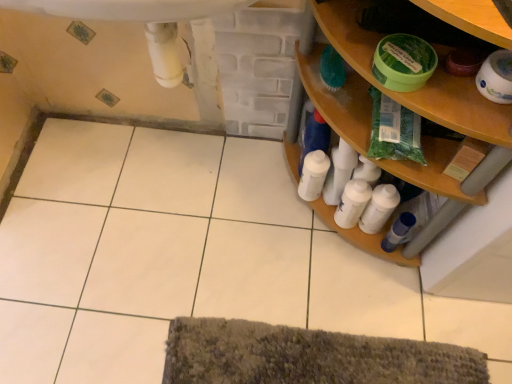
Image resolution: width=512 pixels, height=384 pixels. Describe the element at coordinates (398, 231) in the screenshot. I see `blue glossy bottle at lower right, arranged as the 3th toiletry when viewed from the left` at that location.

The height and width of the screenshot is (384, 512). Describe the element at coordinates (413, 110) in the screenshot. I see `wooden shelf at right` at that location.

In order to face white plastic sink at upper center, should I rotate leftwards or rightwards?

You should rotate left by 15.525 degrees.

The height and width of the screenshot is (384, 512). Identify the location of blue glossy bottle at lower right, which appears as the first toiletry when viewed from the right. (398, 231).

Considering the sizes of objects white glossy bottles at center right, which is the second toiletry in left-to-right order, and blue glossy bottle at lower right, arranged as the 3th toiletry when viewed from the left, in the image provided, who is taller, white glossy bottles at center right, which is the second toiletry in left-to-right order, or blue glossy bottle at lower right, arranged as the 3th toiletry when viewed from the left,?

With more height is white glossy bottles at center right, which is the second toiletry in left-to-right order.

In terms of width, does white glossy bottles at center right, which is the 2th toiletry from right to left, look wider or thinner when compared to blue glossy bottle at lower right, arranged as the 3th toiletry when viewed from the left?

white glossy bottles at center right, which is the 2th toiletry from right to left, is thinner than blue glossy bottle at lower right, arranged as the 3th toiletry when viewed from the left.

Consider the image. Can you confirm if white glossy bottles at center right, which is the second toiletry in left-to-right order, is bigger than blue glossy bottle at lower right, arranged as the 3th toiletry when viewed from the left?

Yes.

From a real-world perspective, which toiletry is the 1st one above the blue glossy bottle at lower right, which appears as the first toiletry when viewed from the right? Please provide its 2D coordinates.

[(379, 208)]

Which is closer, (507,103) or (417,138)?

Positioned in front is point (507,103).

In the scene shown: Considering the relative sizes of white glossy toilet paper at upper right and green plastic bag at upper right in the image provided, is white glossy toilet paper at upper right shorter than green plastic bag at upper right?

Correct, white glossy toilet paper at upper right is not as tall as green plastic bag at upper right.

Is white glossy toilet paper at upper right bigger or smaller than green plastic bag at upper right?

white glossy toilet paper at upper right is smaller than green plastic bag at upper right.

Would you consider white glossy toilet paper at upper right to be distant from green plastic bag at upper right?

That's not correct — white glossy toilet paper at upper right is a little close to green plastic bag at upper right.

From a real-world perspective, is green plastic bag at upper right located beneath wooden shelf at right?

Incorrect, from a real-world perspective, green plastic bag at upper right is higher than wooden shelf at right.

Does green plastic bag at upper right turn towards wooden shelf at right?

Yes, green plastic bag at upper right is facing wooden shelf at right.

Is green plastic bag at upper right beside wooden shelf at right?

green plastic bag at upper right is not next to wooden shelf at right, and they're not touching.

From the image's perspective, is green plastic bag at upper right located beneath wooden shelf at right?

Yes, from the image's perspective, green plastic bag at upper right is below wooden shelf at right.

Is white glossy bottle at lower right, the 3th toiletry viewed from the right, in front of or behind white glossy toilet paper at upper right in the image?

Visually, white glossy bottle at lower right, the 3th toiletry viewed from the right, is located behind white glossy toilet paper at upper right.

How different are the orientations of white glossy bottle at lower right, the first toiletry when ordered from left to right, and white glossy toilet paper at upper right in degrees?

The angle between the facing direction of white glossy bottle at lower right, the first toiletry when ordered from left to right, and the facing direction of white glossy toilet paper at upper right is 29.5 degrees.

Which of these two, white glossy bottle at lower right, the first toiletry when ordered from left to right, or white glossy toilet paper at upper right, is wider?

white glossy toilet paper at upper right.

Considering the sizes of white glossy bottle at lower right, the 3th toiletry viewed from the right, and white glossy toilet paper at upper right in the image, is white glossy bottle at lower right, the 3th toiletry viewed from the right, taller or shorter than white glossy toilet paper at upper right?

Clearly, white glossy bottle at lower right, the 3th toiletry viewed from the right, is taller compared to white glossy toilet paper at upper right.

Considering the sizes of objects white glossy toilet paper at upper right and white glossy bottles at center right, which is the 2th toiletry from right to left, in the image provided, who is thinner, white glossy toilet paper at upper right or white glossy bottles at center right, which is the 2th toiletry from right to left,?

Thinner between the two is white glossy bottles at center right, which is the 2th toiletry from right to left.

Does white glossy toilet paper at upper right contain white glossy bottles at center right, which is the second toiletry in left-to-right order?

No, white glossy toilet paper at upper right does not contain white glossy bottles at center right, which is the second toiletry in left-to-right order.

Which is in front, point (494, 90) or point (378, 202)?

The point (494, 90) is closer.

Is white glossy toilet paper at upper right shorter than white glossy bottles at center right, which is the 2th toiletry from right to left?

Indeed, white glossy toilet paper at upper right has a lesser height compared to white glossy bottles at center right, which is the 2th toiletry from right to left.

From the picture: Is green plastic bag at upper right shorter than white plastic sink at upper center?

Yes.

Is green plastic bag at upper right inside the boundaries of white plastic sink at upper center, or outside?

green plastic bag at upper right exists outside the volume of white plastic sink at upper center.

From the image's perspective, which is below, green plastic bag at upper right or white plastic sink at upper center?

From the image's view, green plastic bag at upper right is below.

Can you confirm if green plastic bag at upper right is thinner than white plastic sink at upper center?

In fact, green plastic bag at upper right might be wider than white plastic sink at upper center.

Considering their positions, is white glossy bottle at lower right, the 3th toiletry viewed from the right, located in front of or behind white glossy bottles at center right, which is the second toiletry in left-to-right order?

white glossy bottle at lower right, the 3th toiletry viewed from the right, is positioned farther from the viewer than white glossy bottles at center right, which is the second toiletry in left-to-right order.

In the scene shown: Is white glossy bottle at lower right, the first toiletry when ordered from left to right, situated inside white glossy bottles at center right, which is the second toiletry in left-to-right order, or outside?

white glossy bottle at lower right, the first toiletry when ordered from left to right, is not inside white glossy bottles at center right, which is the second toiletry in left-to-right order, it's outside.

Is white glossy bottle at lower right, the first toiletry when ordered from left to right, oriented towards white glossy bottles at center right, which is the 2th toiletry from right to left?

No, white glossy bottle at lower right, the first toiletry when ordered from left to right, is not oriented towards white glossy bottles at center right, which is the 2th toiletry from right to left.

I want to click on toiletry that is on the right side of white glossy bottles at center right, which is the second toiletry in left-to-right order, so click(x=398, y=231).

In the image, there is a white glossy toilet paper at upper right. Identify the location of material below it (from the image's perspective). This screenshot has width=512, height=384. (400, 135).

Based on their spatial positions, is blue glossy bottle at lower right, arranged as the 3th toiletry when viewed from the left, or white glossy bottles at center right, which is the second toiletry in left-to-right order, closer to wooden shelf at right?

Based on the image, white glossy bottles at center right, which is the second toiletry in left-to-right order, appears to be nearer to wooden shelf at right.

From the image, which object appears to be farther from green plastic bag at upper right, wooden shelf at right or blue glossy bottle at lower right, which appears as the first toiletry when viewed from the right?

blue glossy bottle at lower right, which appears as the first toiletry when viewed from the right, lies further to green plastic bag at upper right than the other object.

Considering their positions, is white glossy toilet paper at upper right positioned further to white plastic sink at upper center than wooden shelf at right?

white glossy toilet paper at upper right is further to white plastic sink at upper center.

Consider the image. Which object lies nearer to the anchor point white glossy bottle at lower right, the first toiletry when ordered from left to right, white glossy toilet paper at upper right or white glossy bottles at center right, which is the 2th toiletry from right to left?

white glossy bottles at center right, which is the 2th toiletry from right to left, is positioned closer to the anchor white glossy bottle at lower right, the first toiletry when ordered from left to right.

From the image, which object appears to be farther from white glossy bottle at lower right, the first toiletry when ordered from left to right, white glossy bottles at center right, which is the second toiletry in left-to-right order, or wooden shelf at right?

wooden shelf at right is positioned further to the anchor white glossy bottle at lower right, the first toiletry when ordered from left to right.

From the image, which object appears to be nearer to white glossy bottle at lower right, the first toiletry when ordered from left to right, green plastic bag at upper right or white glossy bottles at center right, which is the second toiletry in left-to-right order?

white glossy bottles at center right, which is the second toiletry in left-to-right order, is positioned closer to the anchor white glossy bottle at lower right, the first toiletry when ordered from left to right.

Which object lies nearer to the anchor point white plastic sink at upper center, wooden shelf at right or white glossy bottles at center right, which is the second toiletry in left-to-right order?

wooden shelf at right is positioned closer to the anchor white plastic sink at upper center.

Looking at the image, which one is located further to white plastic sink at upper center, wooden shelf at right or white glossy toilet paper at upper right?

Based on the image, white glossy toilet paper at upper right appears to be further to white plastic sink at upper center.

The height and width of the screenshot is (384, 512). What are the coordinates of `toiletry located between white plastic sink at upper center and blue glossy bottle at lower right, arranged as the 3th toiletry when viewed from the left, in the depth direction` in the screenshot? It's located at point(379,208).

Locate an element on the screen. The image size is (512, 384). toilet paper between wooden shelf at right and green plastic bag at upper right along the z-axis is located at coordinates (496, 77).

In order to click on material between wooden shelf at right and blue glossy bottle at lower right, which appears as the first toiletry when viewed from the right, along the z-axis in this screenshot , I will do `click(400, 135)`.

What are the coordinates of `toilet paper located between wooden shelf at right and white glossy bottle at lower right, the 3th toiletry viewed from the right, in the depth direction` in the screenshot? It's located at (496, 77).